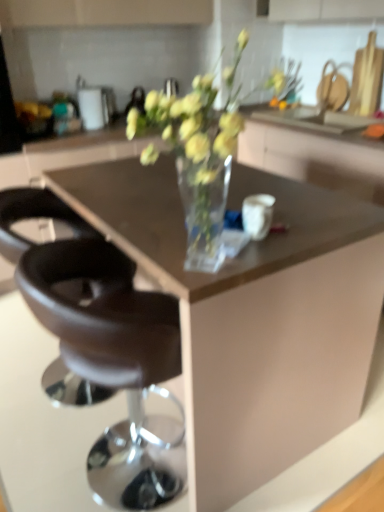
Question: Considering the relative sizes of brown leather stool at center, the second chair in the back-to-front sequence, and transparent glass cabinet at center in the image provided, is brown leather stool at center, the second chair in the back-to-front sequence, thinner than transparent glass cabinet at center?

Choices:
 (A) yes
 (B) no

Answer: (A)

Question: Is brown leather stool at center, the second chair in the back-to-front sequence, turned away from transparent glass cabinet at center?

Choices:
 (A) no
 (B) yes

Answer: (A)

Question: Is the depth of brown leather stool at center, the second chair in the back-to-front sequence, less than that of transparent glass cabinet at center?

Choices:
 (A) yes
 (B) no

Answer: (A)

Question: From a real-world perspective, is brown leather stool at center, the second chair in the back-to-front sequence, over transparent glass cabinet at center?

Choices:
 (A) no
 (B) yes

Answer: (A)

Question: Is brown leather stool at center, the second chair in the back-to-front sequence, not within transparent glass cabinet at center?

Choices:
 (A) yes
 (B) no

Answer: (A)

Question: Would you say black leather stool at lower left, which appears as the first chair when viewed from the back, is to the left or to the right of brown leather stool at center, the second chair in the back-to-front sequence, in the picture?

Choices:
 (A) left
 (B) right

Answer: (A)

Question: Considering their positions, is black leather stool at lower left, which appears as the first chair when viewed from the back, located in front of or behind brown leather stool at center, the first chair positioned from the front?

Choices:
 (A) front
 (B) behind

Answer: (B)

Question: Choose the correct answer: Is black leather stool at lower left, which appears as the first chair when viewed from the back, inside brown leather stool at center, the first chair positioned from the front, or outside it?

Choices:
 (A) outside
 (B) inside

Answer: (A)

Question: In terms of width, does black leather stool at lower left, which appears as the first chair when viewed from the back, look wider or thinner when compared to brown leather stool at center, the first chair positioned from the front?

Choices:
 (A) thin
 (B) wide

Answer: (B)

Question: Is point (304, 153) closer or farther from the camera than point (112, 434)?

Choices:
 (A) closer
 (B) farther

Answer: (A)

Question: Is transparent glass cabinet at center in front of or behind brown leather stool at center, the first chair positioned from the front, in the image?

Choices:
 (A) front
 (B) behind

Answer: (B)

Question: Looking at their shapes, would you say transparent glass cabinet at center is wider or thinner than brown leather stool at center, the first chair positioned from the front?

Choices:
 (A) thin
 (B) wide

Answer: (B)

Question: Looking at the image, does transparent glass cabinet at center seem bigger or smaller compared to brown leather stool at center, the second chair in the back-to-front sequence?

Choices:
 (A) big
 (B) small

Answer: (A)

Question: Is point click(51, 377) positioned closer to the camera than point click(279, 150)?

Choices:
 (A) closer
 (B) farther

Answer: (A)

Question: Choose the correct answer: Is black leather stool at lower left, which appears as the first chair when viewed from the back, inside transparent glass cabinet at center or outside it?

Choices:
 (A) outside
 (B) inside

Answer: (A)